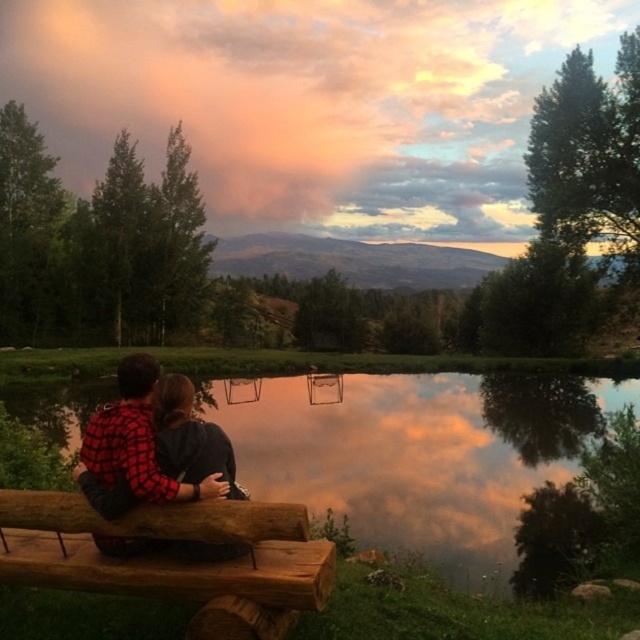
Question: Does rustic wood bench at lower center have a larger size compared to red plaid shirt at lower left?

Choices:
 (A) no
 (B) yes

Answer: (B)

Question: Among these points, which one is farthest from the camera?

Choices:
 (A) (163, 465)
 (B) (202, 534)
 (C) (124, 381)

Answer: (C)

Question: Does smooth reflective water at center appear on the right side of red plaid shirt at lower left?

Choices:
 (A) yes
 (B) no

Answer: (A)

Question: Which of these objects is positioned closest to the red plaid shirt at lower left?

Choices:
 (A) rustic wood bench at lower center
 (B) red plaid shirt at center

Answer: (B)

Question: Is rustic wood bench at lower center positioned in front of red plaid shirt at center?

Choices:
 (A) yes
 (B) no

Answer: (A)

Question: Which of the following is the farthest from the observer?

Choices:
 (A) rustic wood bench at lower center
 (B) red plaid shirt at center
 (C) red plaid shirt at lower left

Answer: (B)